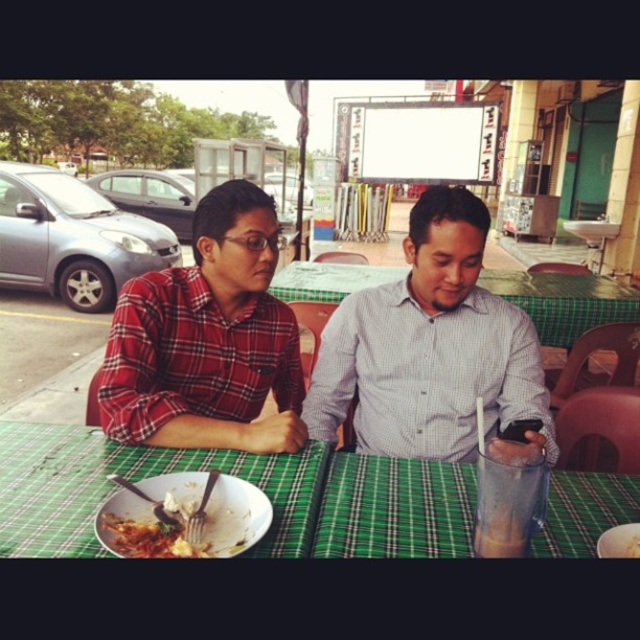
Is point (196, 364) more distant than point (637, 524)?

That is True.

Does point (243, 307) come in front of point (612, 545)?

No.

Find the location of `red plaid shirt at left`. red plaid shirt at left is located at coordinates (208, 340).

Between white checkered shirt at center and white matte plate at center, which one is positioned lower?

Positioned lower is white matte plate at center.

Can you confirm if white checkered shirt at center is taller than white matte plate at center?

Yes, white checkered shirt at center is taller than white matte plate at center.

The height and width of the screenshot is (640, 640). What are the coordinates of `white checkered shirt at center` in the screenshot? It's located at (432, 349).

Can you confirm if green plaid tablecloth at center is wider than plastic fork and spoon at lower center?

Yes, green plaid tablecloth at center is wider than plastic fork and spoon at lower center.

Who is more forward, (0, 445) or (264, 509)?

Point (264, 509) is in front.

Who is more distant from viewer, (74, 541) or (227, 541)?

Point (227, 541)

Locate an element on the screen. The width and height of the screenshot is (640, 640). green plaid tablecloth at center is located at coordinates (241, 477).